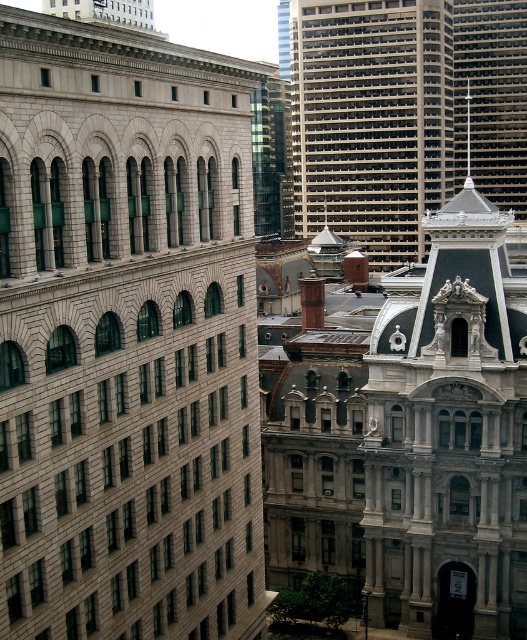
You are standing on the ground floor of the tall, rectangular building on the left and want to look up at the gray concrete skyscraper at upper center and the smooth gray spire at upper right. Which one would you have to tilt your head up more to see?

The gray concrete skyscraper at upper center is above the smooth gray spire at upper right, so you would need to tilt your head up more to see the gray concrete skyscraper at upper center.

You are an architect analyzing the cityscape. You need to determine which structure is taller between the gray stone building at left and the smooth gray spire at upper right. Based on the scene, which one is taller?

The gray stone building at left is taller than the smooth gray spire at upper right according to the description.

You are standing at the base of the tall rectangular building on the left and want to take a photo of the ornate Victorian or Beaux Arts style building in the center and right. There are two points marked in the scene, point 1 at coordinates point (x=521, y=131) and point 2 at coordinates point (x=467, y=141). Which point should you stand at to ensure the ornate building is fully visible without any obstruction from the tall rectangular building?

You should stand at point (x=467, y=141) because point (x=521, y=131) is in front of it, meaning standing at point (x=467, y=141) would provide a clearer view of the ornate building without obstruction from the tall rectangular building.